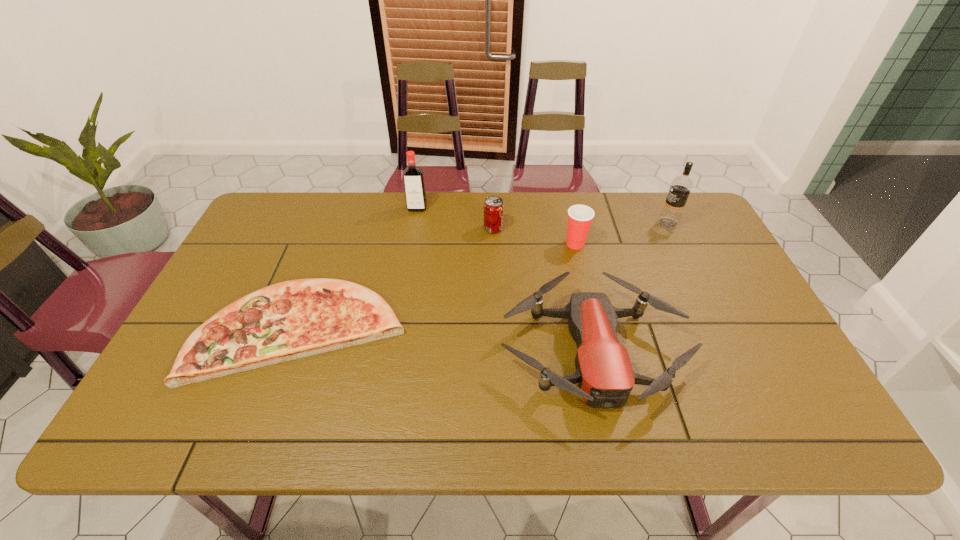
The height and width of the screenshot is (540, 960). What are the coordinates of `object that is positioned at the far right corner` in the screenshot? It's located at (681, 186).

I want to click on vacant space at the far edge of the desktop, so click(x=538, y=228).

I want to click on free point at the near edge, so click(x=348, y=425).

Where is `free space at the left edge of the desktop`? This screenshot has width=960, height=540. free space at the left edge of the desktop is located at coordinates (214, 308).

This screenshot has height=540, width=960. In order to click on vacant space at the right edge of the desktop in this screenshot , I will do `click(720, 318)`.

This screenshot has height=540, width=960. Find the location of `vacant region at the far left corner of the desktop`. vacant region at the far left corner of the desktop is located at coordinates (272, 225).

This screenshot has height=540, width=960. Identify the location of free point between the drone and the pizza. (447, 340).

Where is `free space between the left vodka and the nearer vodka`? free space between the left vodka and the nearer vodka is located at coordinates (542, 216).

Where is `vacant area that lies between the shortest object and the farther vodka`? vacant area that lies between the shortest object and the farther vodka is located at coordinates (359, 269).

This screenshot has width=960, height=540. In order to click on free area in between the pop soda and the farther vodka in this screenshot , I will do `click(455, 218)`.